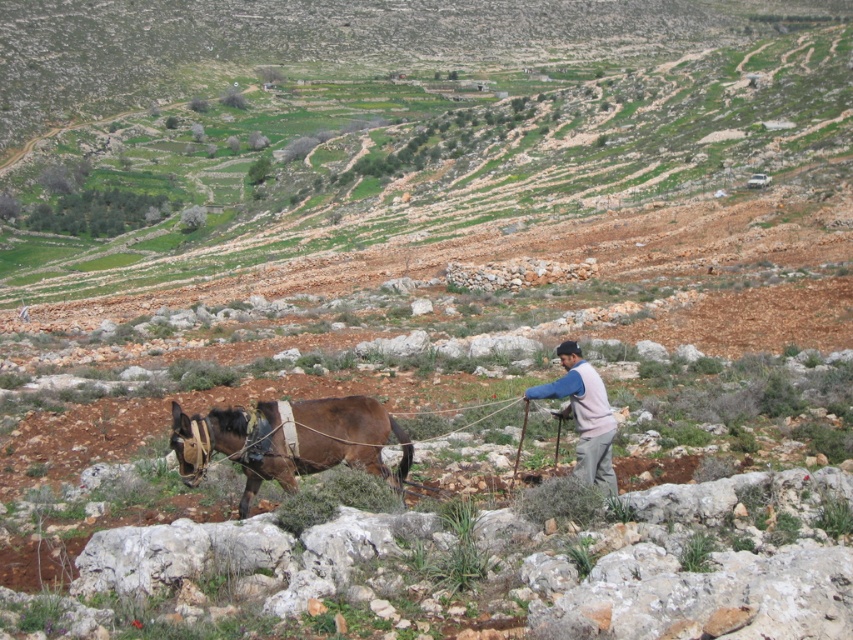
Is point (247, 412) positioned in front of point (573, 401)?

Yes, it is in front of point (573, 401).

Is brown leather donkey at lower left smaller than light brown fabric at center?

Actually, brown leather donkey at lower left might be larger than light brown fabric at center.

Measure the distance between brown leather donkey at lower left and camera.

They are 51.01 feet apart.

This screenshot has height=640, width=853. Identify the location of brown leather donkey at lower left. (288, 440).

Can you confirm if brown soil at center is positioned above brown leather donkey at lower left?

Yes, brown soil at center is above brown leather donkey at lower left.

Which is in front, point (418, 182) or point (300, 413)?

Point (300, 413) is more forward.

Locate an element on the screen. brown soil at center is located at coordinates (387, 124).

Is brown soil at center positioned in front of light brown fabric at center?

No.

Is brown soil at center thinner than light brown fabric at center?

In fact, brown soil at center might be wider than light brown fabric at center.

Measure the distance between point [520,218] and camera.

They are 87.10 meters apart.

Locate an element on the screen. This screenshot has height=640, width=853. brown soil at center is located at coordinates (387, 124).